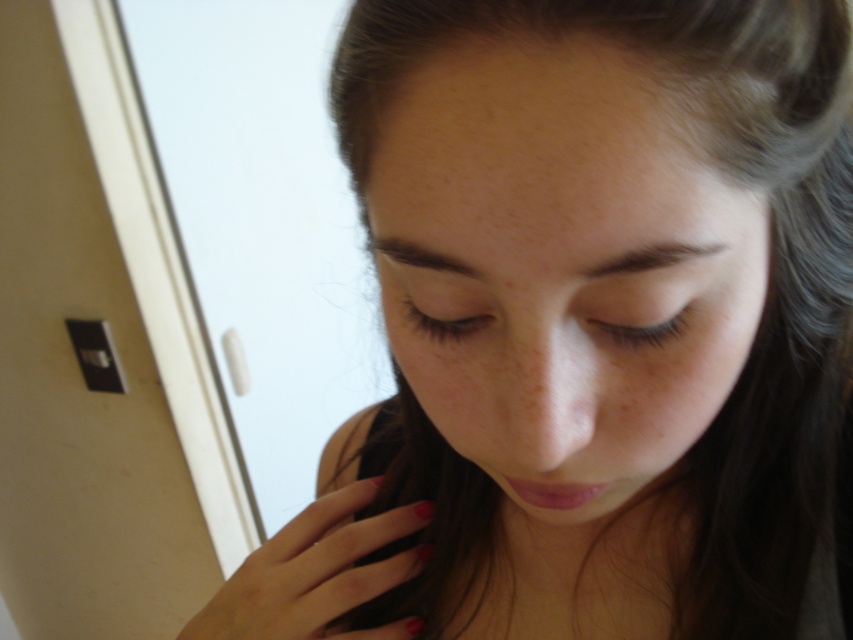
Who is shorter, smooth skin face at center or polished red nails at lower center?

polished red nails at lower center is shorter.

Does smooth skin face at center have a lesser width compared to polished red nails at lower center?

Indeed, smooth skin face at center has a lesser width compared to polished red nails at lower center.

Is point (720, 205) in front of point (318, 516)?

Yes, point (720, 205) is closer to viewer.

You are a GUI agent. You are given a task and a screenshot of the screen. Output one action in this format:
    pyautogui.click(x=<x>, y=<y>)
    Task: Click on the smooth skin face at center
    
    Given the screenshot: What is the action you would take?
    pyautogui.click(x=560, y=268)